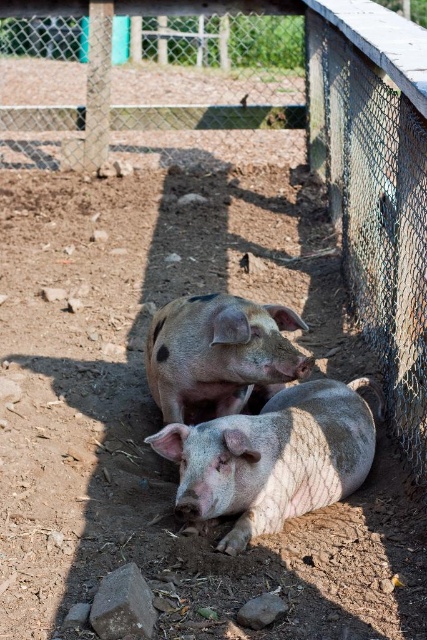
Question: Which point is closer to the camera?

Choices:
 (A) speckled pink pig at center
 (B) metal mesh fence at upper center
 (C) pink matte pig at center

Answer: (A)

Question: Does metal mesh fence at upper center have a larger size compared to speckled pink pig at center?

Choices:
 (A) no
 (B) yes

Answer: (B)

Question: Which point is farther from the camera taking this photo?

Choices:
 (A) (219, 19)
 (B) (216, 339)

Answer: (A)

Question: Which point is closer to the camera?

Choices:
 (A) pink matte pig at center
 (B) speckled pink pig at center
 (C) metal mesh fence at upper center

Answer: (B)

Question: Does metal mesh fence at upper center have a smaller size compared to pink matte pig at center?

Choices:
 (A) no
 (B) yes

Answer: (A)

Question: Is metal mesh fence at upper center further to camera compared to speckled pink pig at center?

Choices:
 (A) no
 (B) yes

Answer: (B)